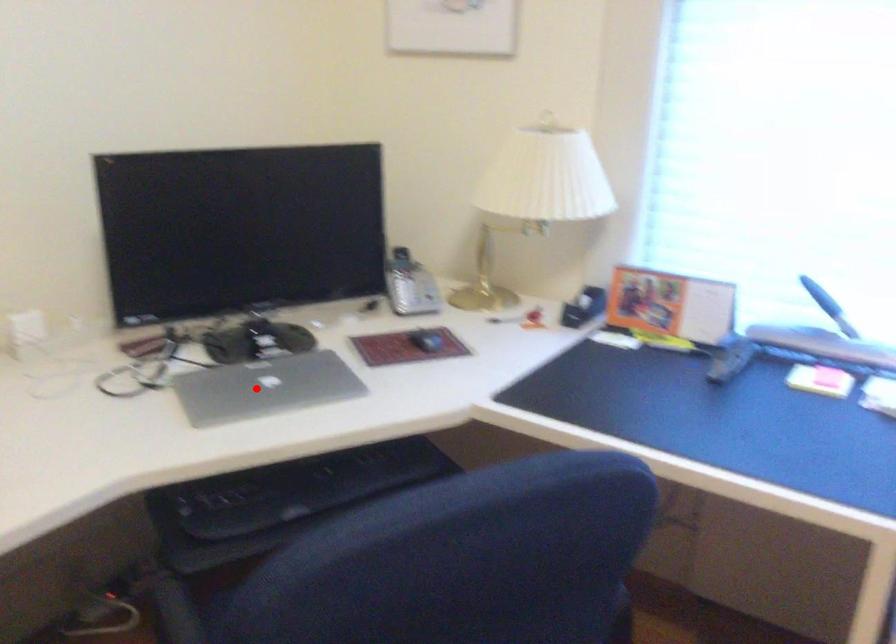
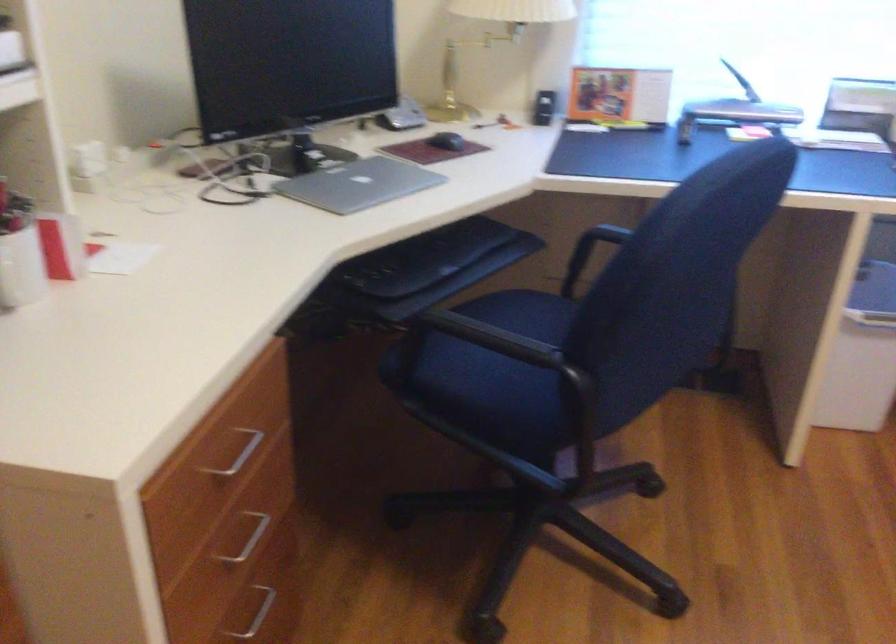
Locate, in the second image, the point that corresponds to the highlighted location in the first image.

(358, 184)